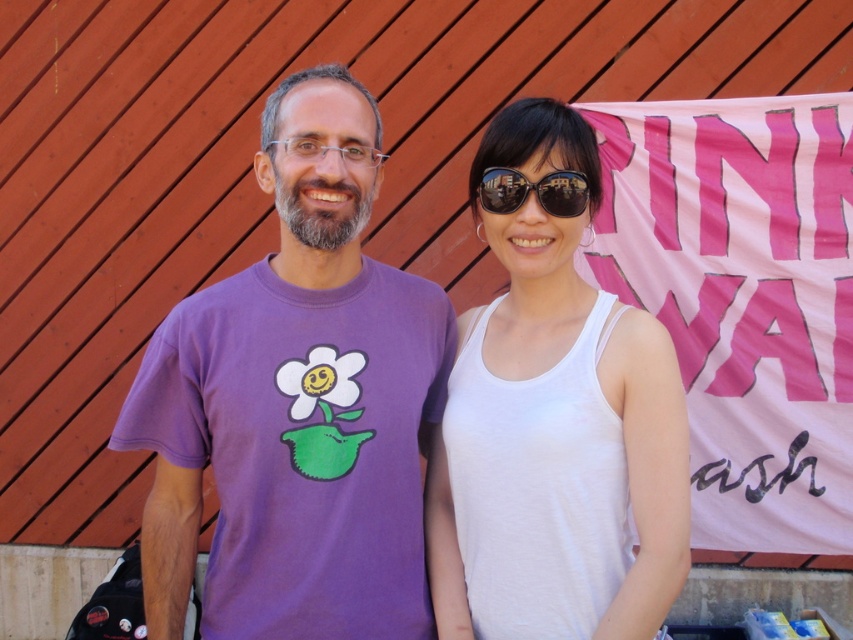
You are a photographer trying to focus on the purple cotton t shirt at left. The camera has a focus point at position (x=297, y=404). Is the focus point on the purple cotton t shirt at left?

Yes, the focus point at (x=297, y=404) is on the purple cotton t shirt at left according to the description.